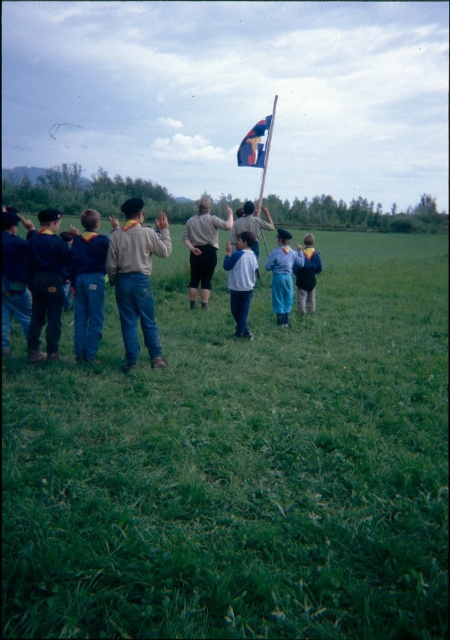
Question: Is the position of blue fabric flag at upper center less distant than that of white shirt at center?

Choices:
 (A) no
 (B) yes

Answer: (A)

Question: Which object is the farthest from the blue cotton pants at center?

Choices:
 (A) light brown fabric shirt at center
 (B) matte khaki shirt at center
 (C) white matte shirt at center
 (D) white shirt at center

Answer: (B)

Question: Where is blue denim jacket at center located in relation to blue fabric flag at upper center in the image?

Choices:
 (A) right
 (B) left

Answer: (B)

Question: Does light brown fabric shirt at center lie behind metallic flagpole at center?

Choices:
 (A) yes
 (B) no

Answer: (B)

Question: Which point is closer to the camera?

Choices:
 (A) denim pants at left
 (B) green grassy field at center
 (C) matte khaki shirt at center
 (D) white shirt at center

Answer: (B)

Question: Which point is closer to the camera taking this photo?

Choices:
 (A) (207, 285)
 (B) (166, 300)

Answer: (A)